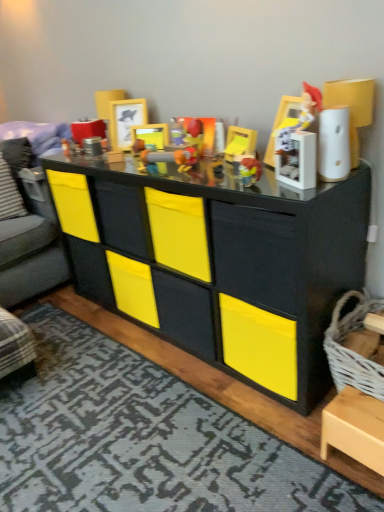
Question: Is translucent plastic toy at center, arranged as the 2th toy when viewed from the right, in front of or behind black matte chest of drawers at center in the image?

Choices:
 (A) behind
 (B) front

Answer: (A)

Question: Does point (253, 166) appear closer or farther from the camera than point (339, 273)?

Choices:
 (A) closer
 (B) farther

Answer: (A)

Question: Estimate the real-world distances between objects in this image. Which object is farther from the plastic toy gun at center, which is the fifth toy from right to left?

Choices:
 (A) striped fabric pillow at left
 (B) black matte chest of drawers at center
 (C) white glossy figurine at upper right, the 1th toy viewed from the right
 (D) light wood cabinet at lower right
 (E) white wicker basket at lower right

Answer: (D)

Question: Which object is positioned farthest from the wooden picture frame at upper center, the first picture frame when ordered from back to front?

Choices:
 (A) plastic toy gun at center, which is the fifth toy from right to left
 (B) matte plastic toy at center, the 2th toy in the left-to-right sequence
 (C) translucent plastic toy at center, arranged as the 2th toy when viewed from the right
 (D) white wicker basket at lower right
 (E) matte plastic toy at center, which ranks as the third toy in left-to-right order

Answer: (D)